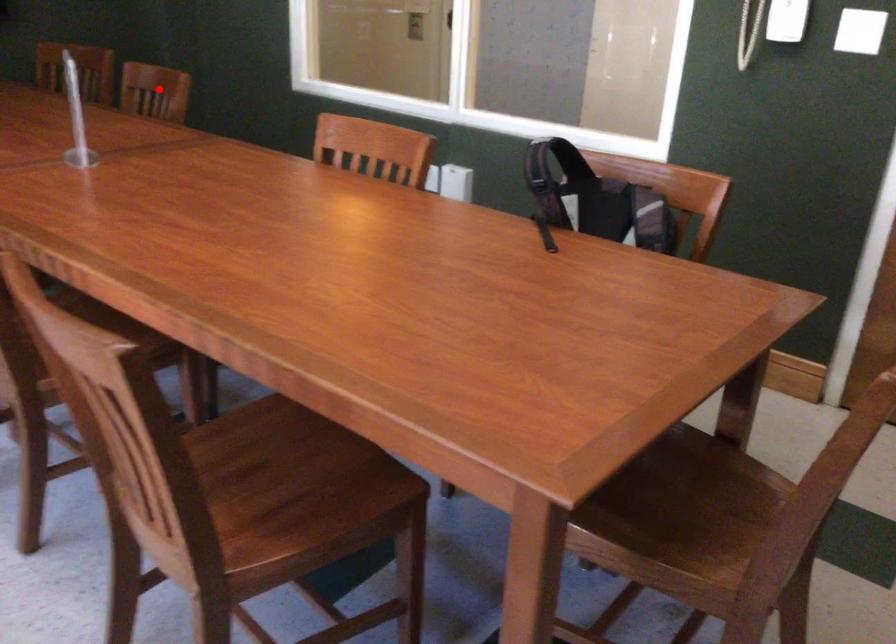
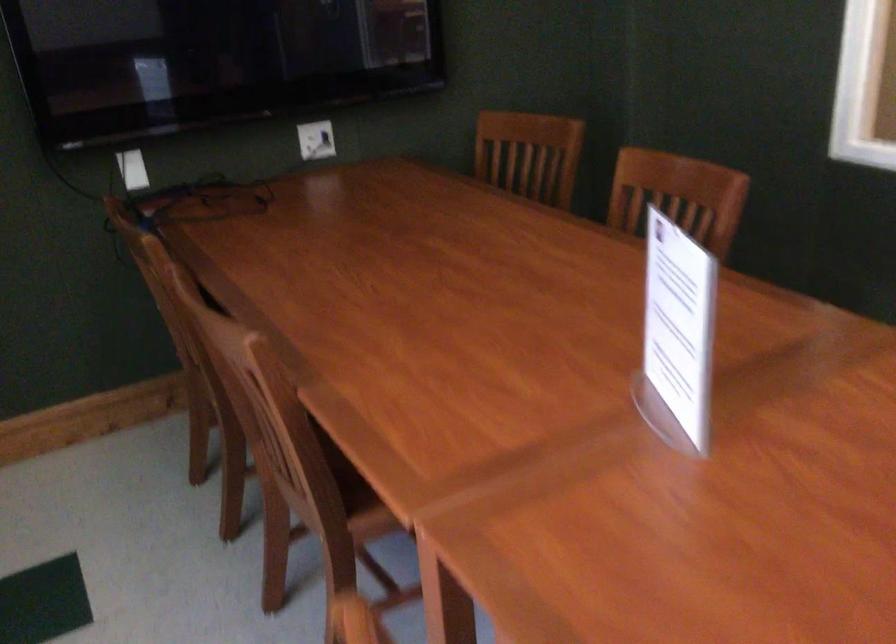
Locate, in the second image, the point that corresponds to the highlighted location in the first image.

(677, 196)